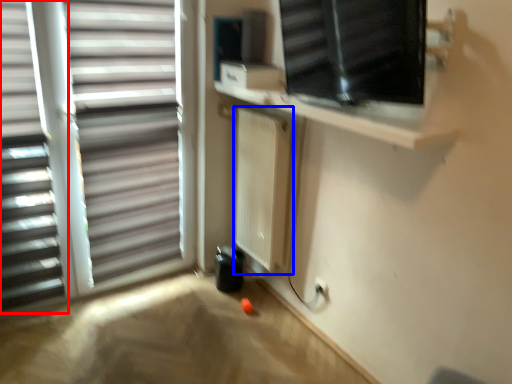
Question: Among these objects, which one is farthest to the camera, window blind (highlighted by a red box) or radiator (highlighted by a blue box)?

Choices:
 (A) window blind
 (B) radiator

Answer: (B)